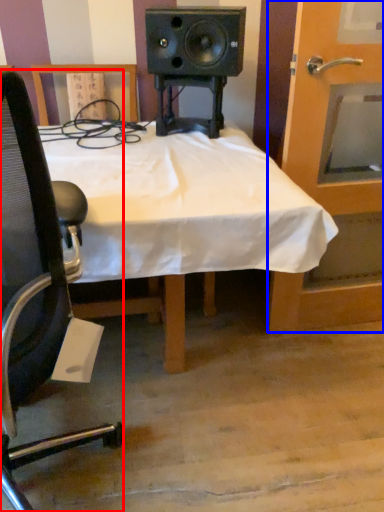
Question: Among these objects, which one is farthest to the camera, chair (highlighted by a red box) or door (highlighted by a blue box)?

Choices:
 (A) chair
 (B) door

Answer: (B)